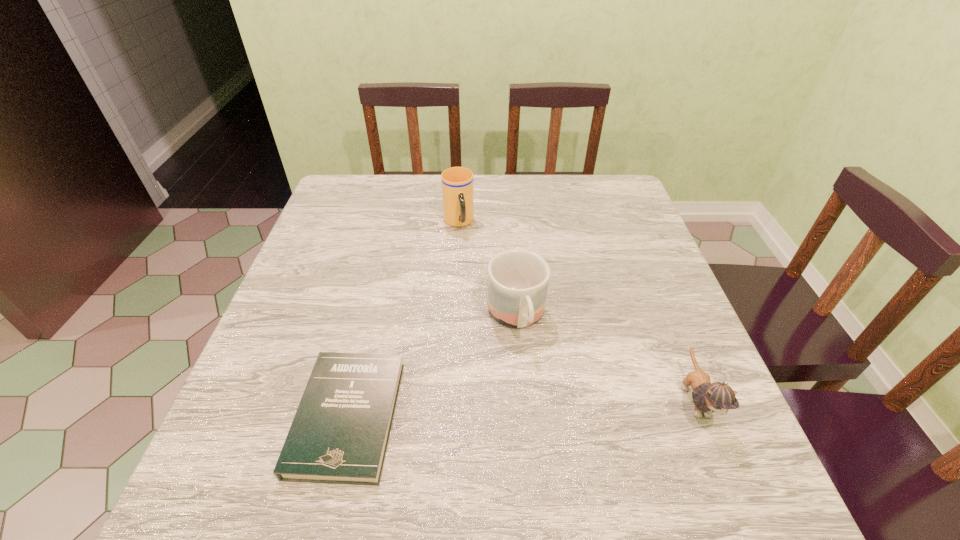
Find the location of a particular element. free space that is in between the leftmost object and the third object from left to right is located at coordinates (432, 367).

Identify the location of empty location between the book and the mug. (432, 367).

Locate an element on the screen. The height and width of the screenshot is (540, 960). free spot between the second object from right to left and the shortest object is located at coordinates (432, 367).

Find the location of a particular element. empty space between the rightmost object and the book is located at coordinates (521, 408).

You are a GUI agent. You are given a task and a screenshot of the screen. Output one action in this format:
    pyautogui.click(x=<x>, y=<y>)
    Task: Click on the closest object relative to the mug
    Image resolution: width=960 pixels, height=540 pixels.
    Given the screenshot: What is the action you would take?
    pyautogui.click(x=339, y=435)

Locate an element on the screen. This screenshot has width=960, height=540. object that ranks as the second closest to the third nearest object is located at coordinates (457, 182).

Find the location of `vacant area in the image that satisfies the following two spatial constraints: 1. on the back side of the third object from right to left; 2. on the right side of the book`. vacant area in the image that satisfies the following two spatial constraints: 1. on the back side of the third object from right to left; 2. on the right side of the book is located at coordinates (395, 222).

Identify the location of free location that satisfies the following two spatial constraints: 1. on the back side of the second object from right to left; 2. on the right side of the leftmost object. (372, 317).

At what (x,y) coordinates should I click in order to perform the action: click on free spot that satisfies the following two spatial constraints: 1. on the back side of the mug; 2. on the right side of the shortest object. Please return your answer as a coordinate pair (x, y). The image size is (960, 540). Looking at the image, I should click on (372, 317).